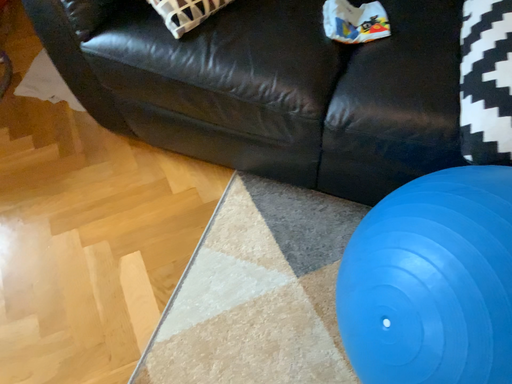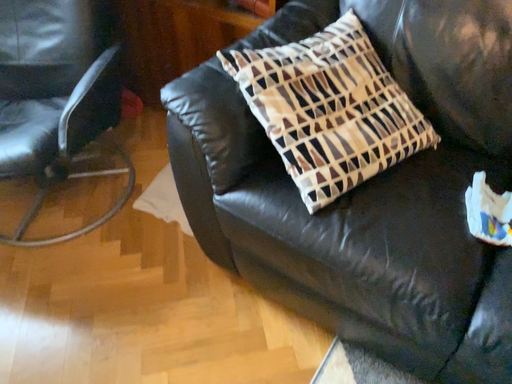
Question: Which way did the camera rotate in the video?

Choices:
 (A) rotated downward
 (B) rotated upward

Answer: (B)